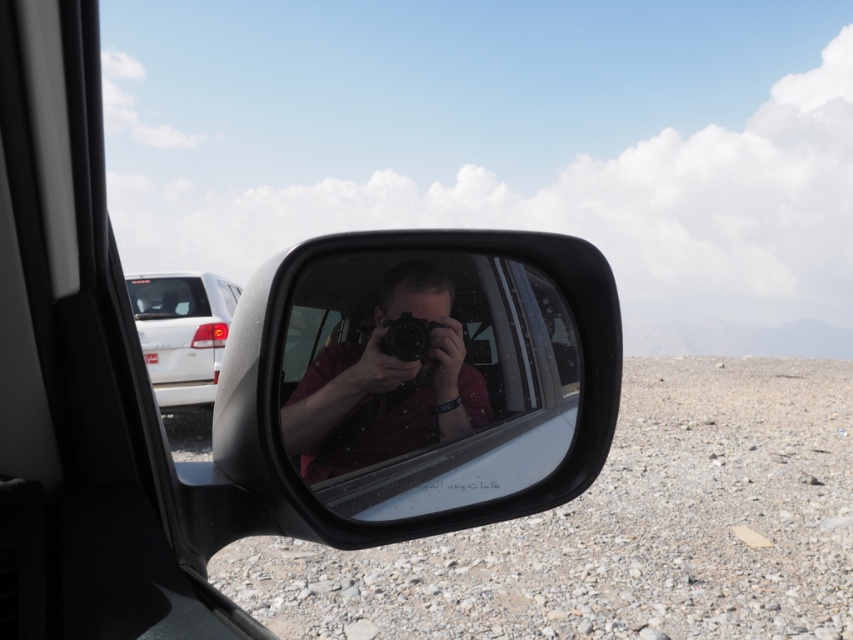
Who is positioned more to the right, black plastic car mirror at center or black plastic camera at center?

Positioned to the right is black plastic car mirror at center.

Does black plastic car mirror at center lie behind black plastic camera at center?

No, black plastic car mirror at center is closer to the viewer.

Image resolution: width=853 pixels, height=640 pixels. What do you see at coordinates (421, 381) in the screenshot?
I see `black plastic car mirror at center` at bounding box center [421, 381].

The image size is (853, 640). In order to click on black plastic car mirror at center in this screenshot , I will do pyautogui.click(x=421, y=381).

Which is behind, point (428, 381) or point (141, 292)?

Positioned behind is point (141, 292).

Does matte black camera at center have a smaller size compared to clear glass car window at upper left?

Indeed, matte black camera at center has a smaller size compared to clear glass car window at upper left.

Does point (317, 387) come farther from viewer compared to point (175, 300)?

No.

The image size is (853, 640). What are the coordinates of `matte black camera at center` in the screenshot? It's located at (386, 385).

How far apart are white glossy sedan at upper left and clear glass car window at upper left?

8.64 inches

Between point (158, 394) and point (144, 288), which one is positioned behind?

The point (144, 288) is more distant.

Which is behind, point (225, 288) or point (138, 304)?

The point (225, 288) is more distant.

The width and height of the screenshot is (853, 640). Find the location of `white glossy sedan at upper left`. white glossy sedan at upper left is located at coordinates (183, 332).